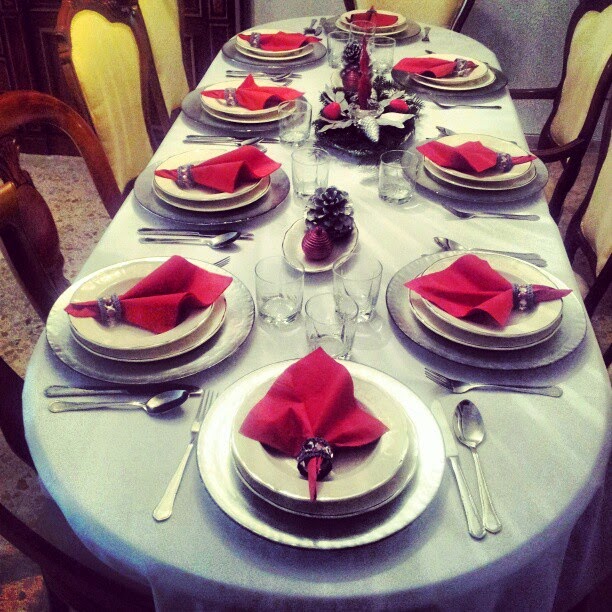
At what (x,y) coordinates should I click in order to perform the action: click on spoons. Please return your answer as a coordinate pair (x, y). Image resolution: width=612 pixels, height=612 pixels. Looking at the image, I should click on (158, 409), (472, 430), (455, 244), (444, 127), (221, 239), (253, 135), (277, 75).